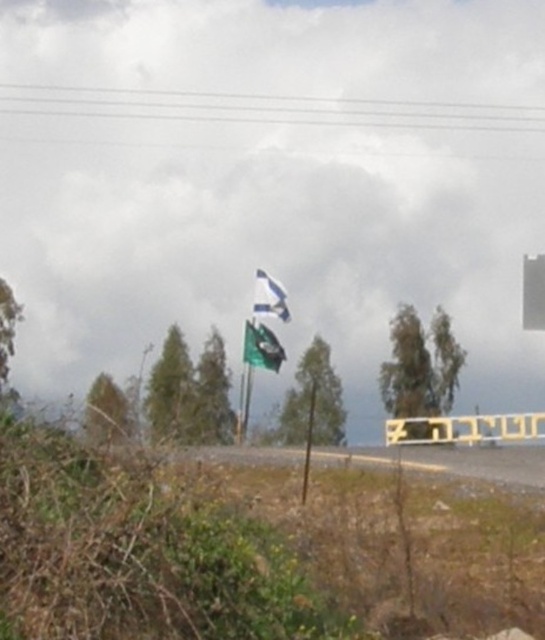
You are a pedestrian standing in front of the yellow plastic sign at center and the green fabric flag at center. Which object is positioned higher from the ground?

The green fabric flag at center is positioned higher from the ground than the yellow plastic sign at center because the yellow plastic sign at center is located below it.

From the picture: You are a delivery driver approaching a checkpoint. You see a yellow plastic sign at center and a white fabric flag at upper center. Which object is narrower in width?

The yellow plastic sign at center is thinner than the white fabric flag at upper center, so the yellow plastic sign at center is narrower in width.

You are a delivery driver who needs to know the width of the yellow plastic sign at center and green fabric flag at center to decide if they can both fit on a 1.5 meter wide shelf. Can both items fit together?

The yellow plastic sign at center is narrower than the green fabric flag at center. However, without knowing the exact widths, it is impossible to determine if their combined width exceeds 1.5 meters. Additional measurements are required.